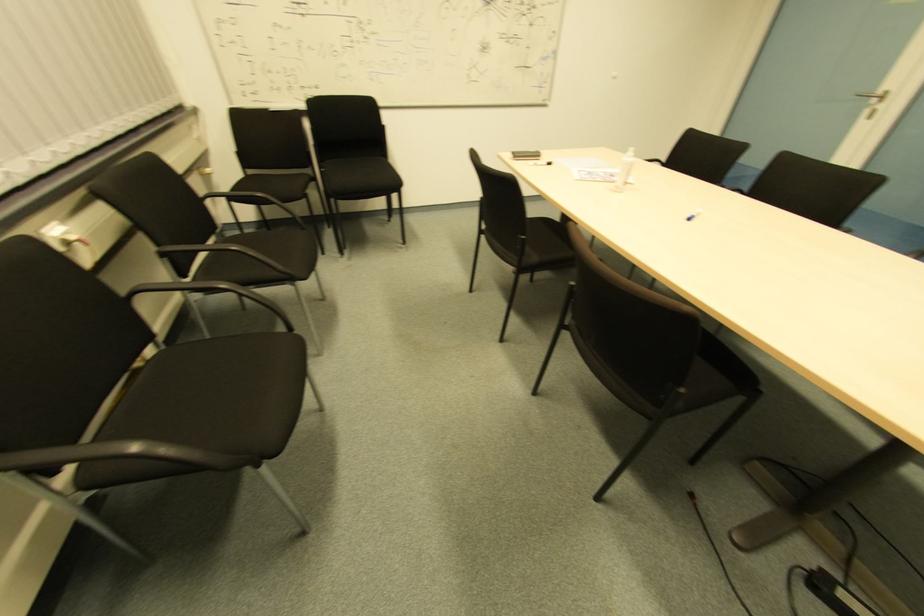
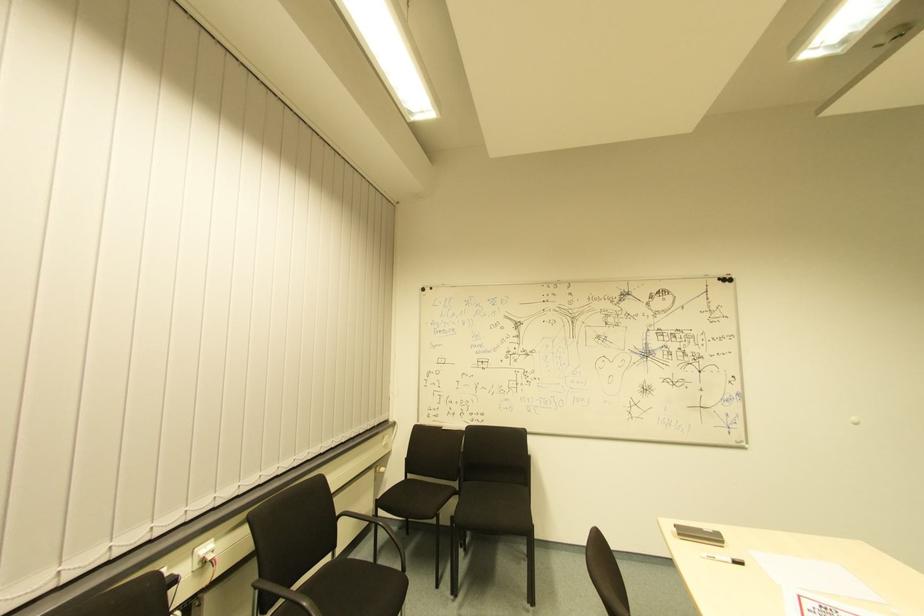
Find the pixel in the second image that matches point 70,241 in the first image.

(208, 561)